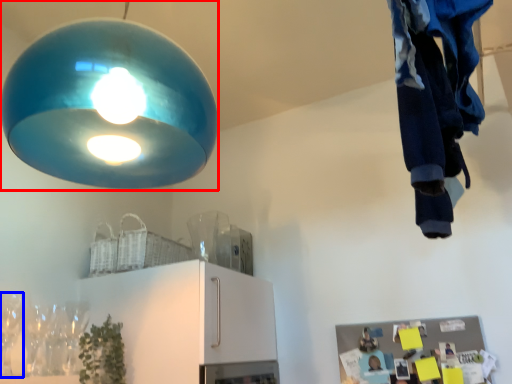
Question: Which object is further to the camera taking this photo, lamp (highlighted by a red box) or wine glass (highlighted by a blue box)?

Choices:
 (A) lamp
 (B) wine glass

Answer: (B)